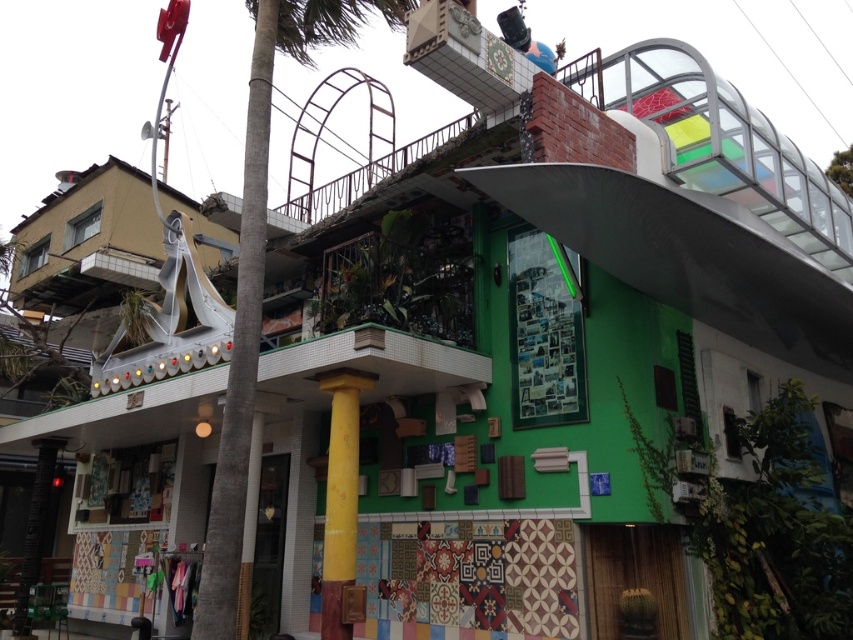
Based on the photo, between green leafy palm tree at center and yellow matte column at center, which one appears on the left side from the viewer's perspective?

green leafy palm tree at center

Describe the element at coordinates (259, 280) in the screenshot. I see `green leafy palm tree at center` at that location.

Locate an element on the screen. green leafy palm tree at center is located at coordinates (259, 280).